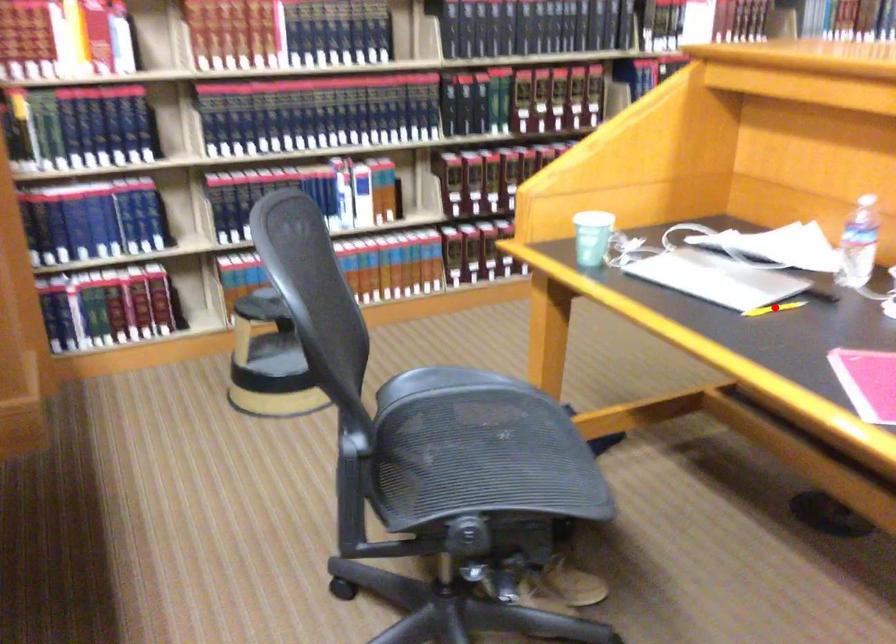
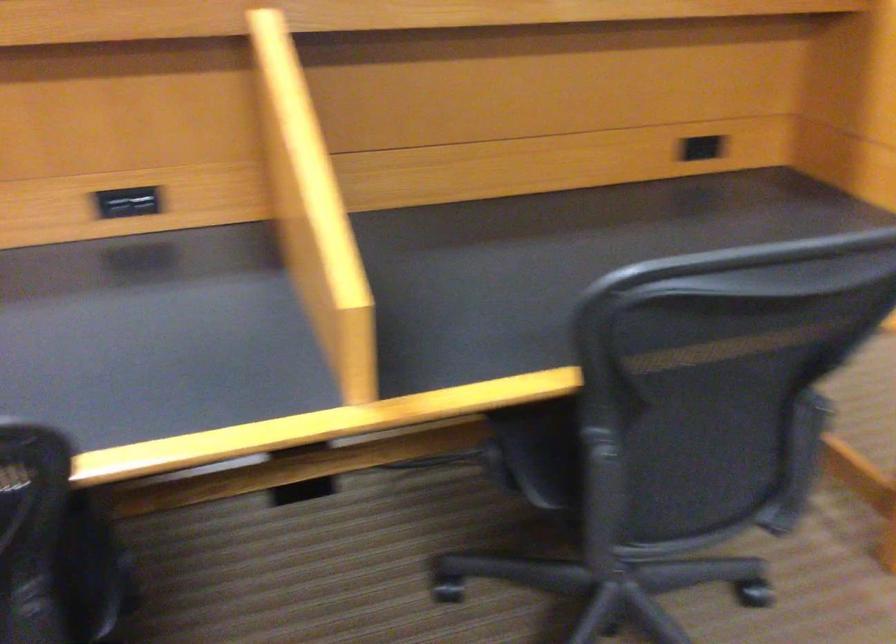
Question: I am providing you with two images of the same scene from different viewpoints. A red point is marked on the first image. Is the red point's position out of view in image 2?

Choices:
 (A) Yes
 (B) No

Answer: (A)